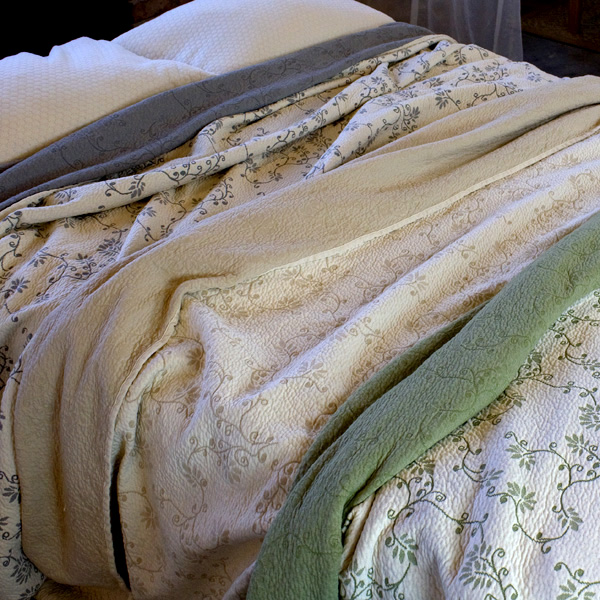
I want to click on floor, so click(551, 55).